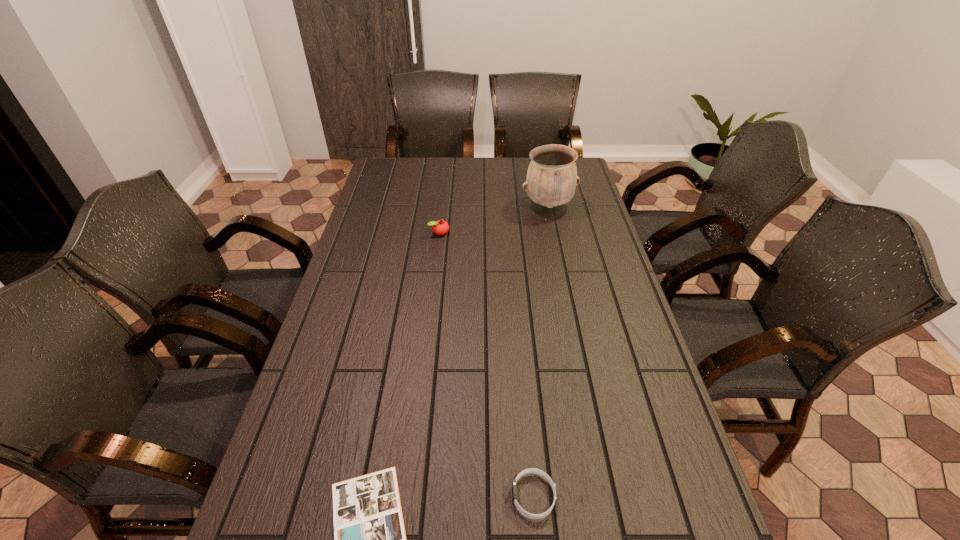
This screenshot has height=540, width=960. In order to click on the tallest object in this screenshot , I will do `click(551, 181)`.

Identify the location of the farthest object. (551, 181).

Locate an element on the screen. the third shortest object is located at coordinates (440, 227).

At what (x,y) coordinates should I click in order to perform the action: click on the third nearest object. Please return your answer as a coordinate pair (x, y). The height and width of the screenshot is (540, 960). Looking at the image, I should click on (440, 227).

The width and height of the screenshot is (960, 540). In order to click on the third tallest object in this screenshot , I will do `click(530, 470)`.

At what (x,y) coordinates should I click in order to perform the action: click on the second object from right to left. Please return your answer as a coordinate pair (x, y). This screenshot has width=960, height=540. Looking at the image, I should click on (530, 470).

The width and height of the screenshot is (960, 540). In order to click on free space located 0.140m on the front of the urn in this screenshot , I will do `click(556, 242)`.

The height and width of the screenshot is (540, 960). Find the location of `free space located 0.180m on the right of the apple`. free space located 0.180m on the right of the apple is located at coordinates (500, 232).

Find the location of a particular element. free point located on the outer surface of the third object from left to right is located at coordinates (362, 496).

Where is `vacant space located on the outer surface of the third object from left to right`? This screenshot has width=960, height=540. vacant space located on the outer surface of the third object from left to right is located at coordinates (440, 496).